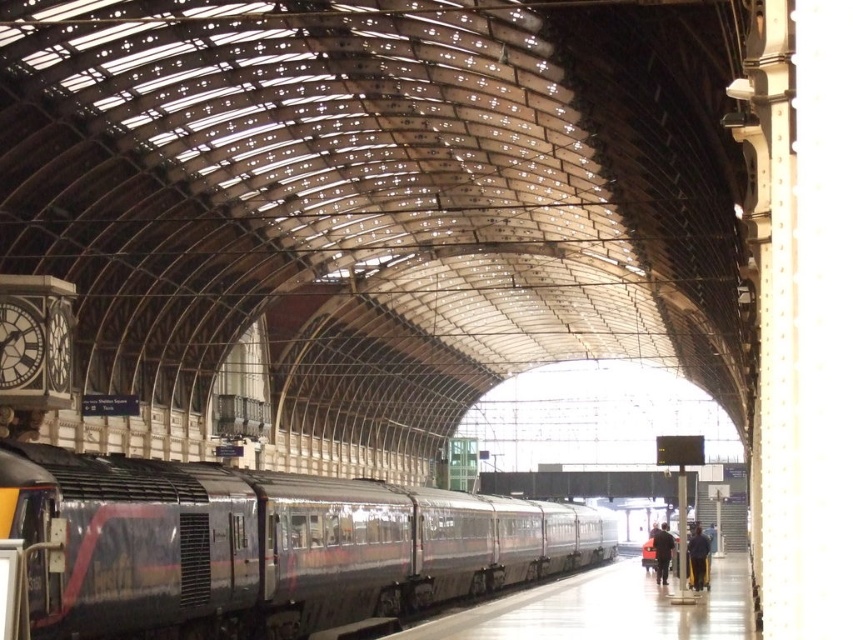
Question: Is polished dark gray train at center thinner than dark blue jacket at lower right?

Choices:
 (A) no
 (B) yes

Answer: (A)

Question: Does dark blue jacket at center come in front of dark blue jacket at lower right?

Choices:
 (A) yes
 (B) no

Answer: (A)

Question: Which object appears closest to the camera in this image?

Choices:
 (A) polished dark gray train at center
 (B) dark blue jacket at lower right

Answer: (A)

Question: Which of the following is the farthest from the observer?

Choices:
 (A) polished dark gray train at center
 (B) dark blue jacket at center
 (C) dark blue jacket at lower right

Answer: (C)

Question: Where is polished dark gray train at center located in relation to dark blue jacket at lower right in the image?

Choices:
 (A) below
 (B) above

Answer: (B)

Question: Based on their relative distances, which object is farther from the dark blue jacket at lower right?

Choices:
 (A) polished dark gray train at center
 (B) dark blue jacket at center

Answer: (A)